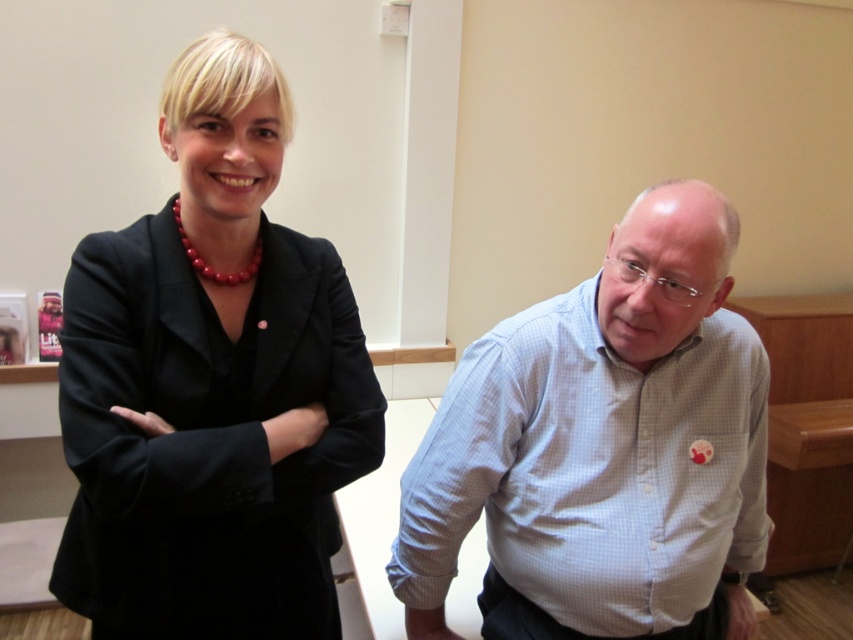
Question: Is black matte blazer at upper left thinner than white checkered shirt at center?

Choices:
 (A) yes
 (B) no

Answer: (A)

Question: Which object is closer to the camera taking this photo?

Choices:
 (A) black matte blazer at upper left
 (B) white checkered shirt at right

Answer: (A)

Question: Estimate the real-world distances between objects in this image. Which object is closer to the white checkered shirt at right?

Choices:
 (A) black matte blazer at upper left
 (B) white checkered shirt at center

Answer: (B)

Question: Which object is positioned farthest from the white checkered shirt at center?

Choices:
 (A) white checkered shirt at right
 (B) black matte blazer at upper left

Answer: (B)

Question: Can you confirm if black matte blazer at upper left is smaller than white checkered shirt at center?

Choices:
 (A) yes
 (B) no

Answer: (A)

Question: Can you confirm if white checkered shirt at center is positioned to the left of white checkered shirt at right?

Choices:
 (A) no
 (B) yes

Answer: (A)